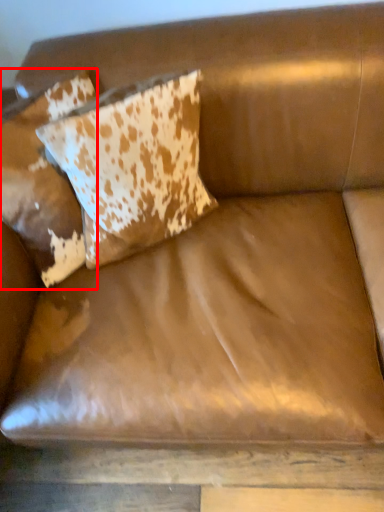
Question: From the image's perspective, where is pillow (annotated by the red box) located in relation to pillow in the image?

Choices:
 (A) below
 (B) above

Answer: (A)